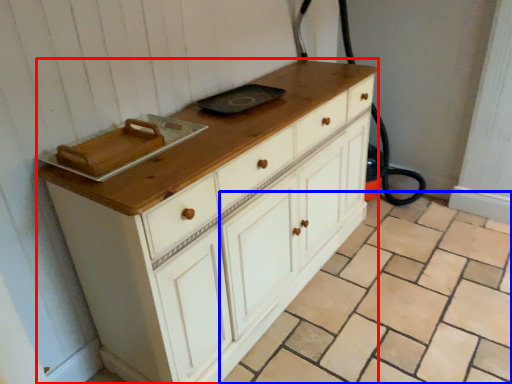
Question: Which point is further to the camera, chest of drawers (highlighted by a red box) or tile (highlighted by a blue box)?

Choices:
 (A) chest of drawers
 (B) tile

Answer: (A)